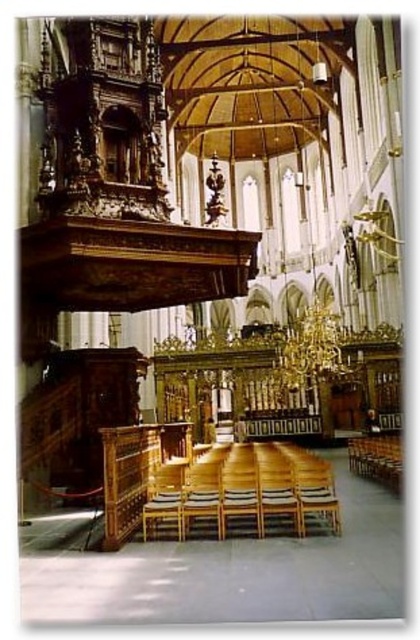
Looking at this image, is wooden at center bigger than wooden chair at lower right?

Correct, wooden at center is larger in size than wooden chair at lower right.

Does wooden at center appear on the right side of wooden chair at lower right?

No, wooden at center is not to the right of wooden chair at lower right.

You are a GUI agent. You are given a task and a screenshot of the screen. Output one action in this format:
    pyautogui.click(x=<x>, y=<y>)
    Task: Click on the wooden at center
    This screenshot has height=640, width=420.
    Given the screenshot: What is the action you would take?
    pyautogui.click(x=246, y=490)